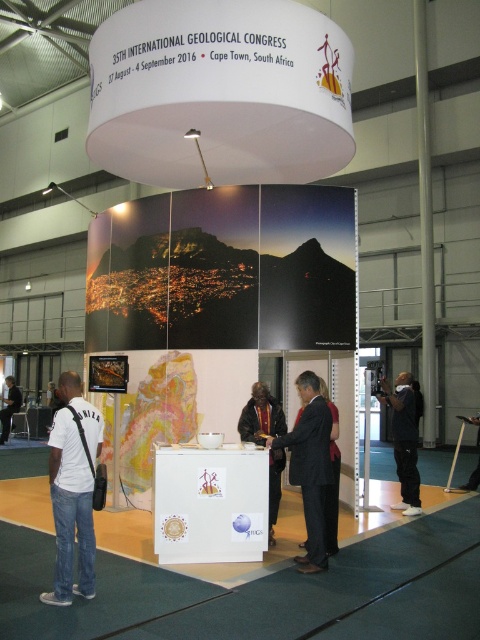
Is white cotton shirt at lower left taller than white fabric bag at lower left?

Correct, white cotton shirt at lower left is much taller as white fabric bag at lower left.

Which is behind, point (74, 532) or point (6, 429)?

The point (6, 429) is more distant.

The width and height of the screenshot is (480, 640). Find the location of `white cotton shirt at lower left`. white cotton shirt at lower left is located at coordinates (72, 492).

Which is in front, point (300, 387) or point (7, 397)?

Point (300, 387) is in front.

Where is `dark suit at center`? The height and width of the screenshot is (640, 480). dark suit at center is located at coordinates (310, 467).

In the scene shown: Is dark suit at center below velvet-like brown coat at center?

No, dark suit at center is not below velvet-like brown coat at center.

Is dark suit at center thinner than velvet-like brown coat at center?

Incorrect, dark suit at center's width is not less than velvet-like brown coat at center's.

Between point (320, 493) and point (272, 464), which one is positioned in front?

Point (320, 493)

I want to click on dark suit at center, so click(x=310, y=467).